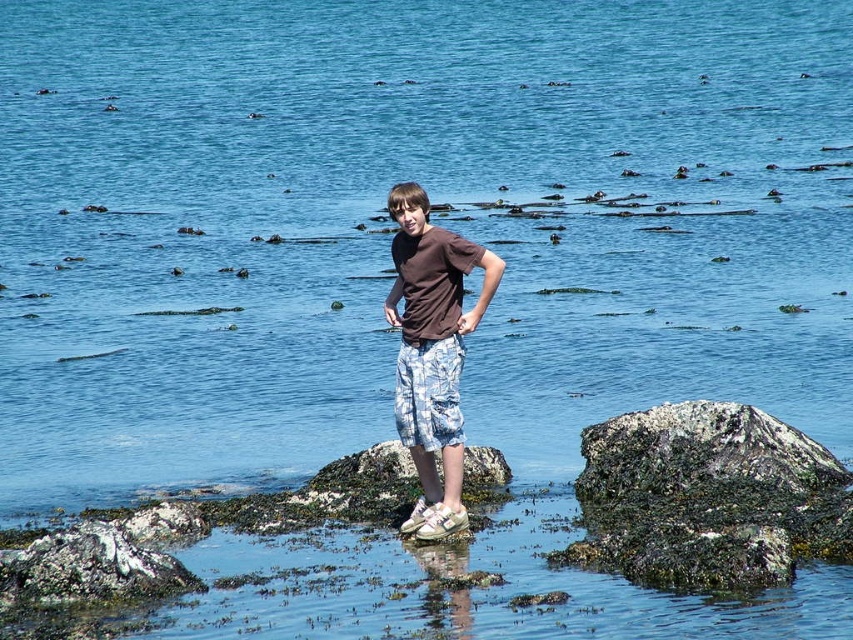
You are a photographer setting up a shot of the person in the coastal scene. You notice the brown cotton shirt at center and the blue camouflage shorts at center. Which clothing item is positioned lower on the person?

The brown cotton shirt at center is located below blue camouflage shorts at center, so the brown cotton shirt at center is positioned lower on the person.

You are a photographer trying to capture the perfect shot of the brown cotton shirt at center and the green mossy rock at lower right. Based on their positions, which object should you focus on first if you want to include both in your frame without moving the camera?

You should focus on the brown cotton shirt at center first because the green mossy rock at lower right is to the right of it, so by centering the shirt, the rock will naturally fall into the frame to its right.

You are the person in the image standing on the rocky outcrop. You notice two points in the water marked as point 1 at coordinates (838, 557) and point 2 at coordinates (438, 412). Which point is closer to your current position?

Point 1 at coordinates (838, 557) is closer to your current position because it is in front of point 2 at coordinates (438, 412).